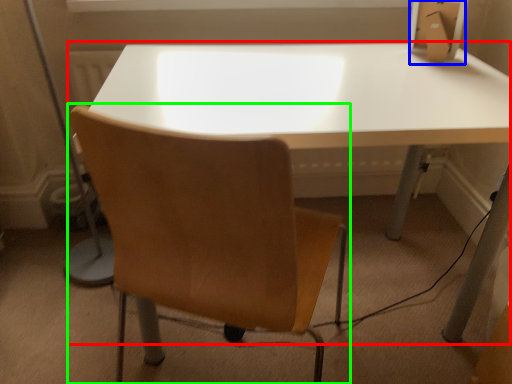
Question: Which object is the closest to the table (highlighted by a red box)? Choose among these: cardboard box (highlighted by a blue box) or chair (highlighted by a green box).

Choices:
 (A) cardboard box
 (B) chair

Answer: (B)